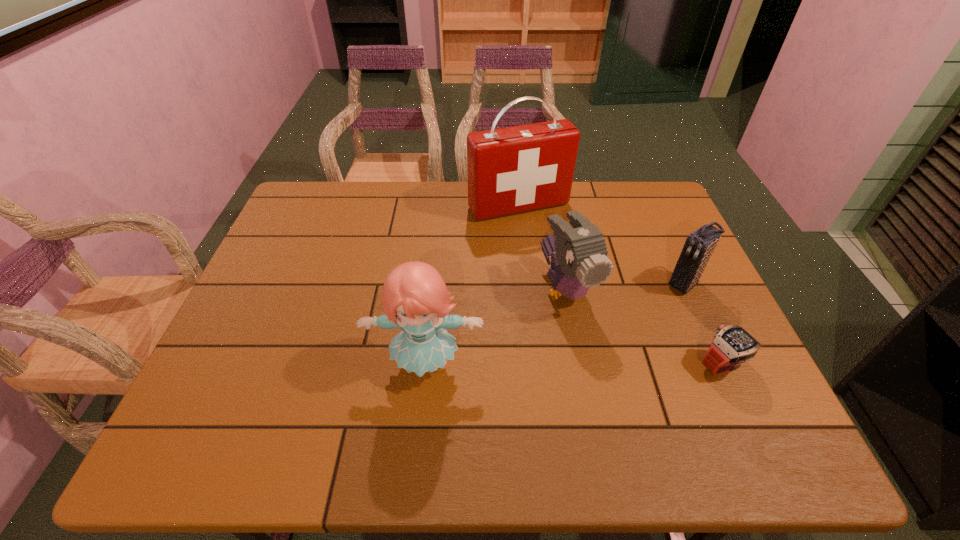
Find the location of a particular element. free location located at the beak of the bird is located at coordinates (637, 409).

Identify the location of free spot located at the beak of the bird. Image resolution: width=960 pixels, height=540 pixels. (596, 345).

Where is `vacant space located 0.080m with the zip open on the clutch bag`? The image size is (960, 540). vacant space located 0.080m with the zip open on the clutch bag is located at coordinates (655, 307).

Locate an element on the screen. blank area located with the zip open on the clutch bag is located at coordinates (594, 354).

Identify the location of vacant space located with the zip open on the clutch bag. (650, 310).

Identify the location of object present at the far edge. The height and width of the screenshot is (540, 960). (510, 170).

Where is `doll situated at the near edge`? The image size is (960, 540). doll situated at the near edge is located at coordinates (415, 291).

The height and width of the screenshot is (540, 960). Identify the location of watch that is at the near edge. (733, 345).

Locate an element on the screen. The width and height of the screenshot is (960, 540). watch present at the right edge is located at coordinates (733, 345).

The height and width of the screenshot is (540, 960). I want to click on clutch bag present at the right edge, so click(x=698, y=248).